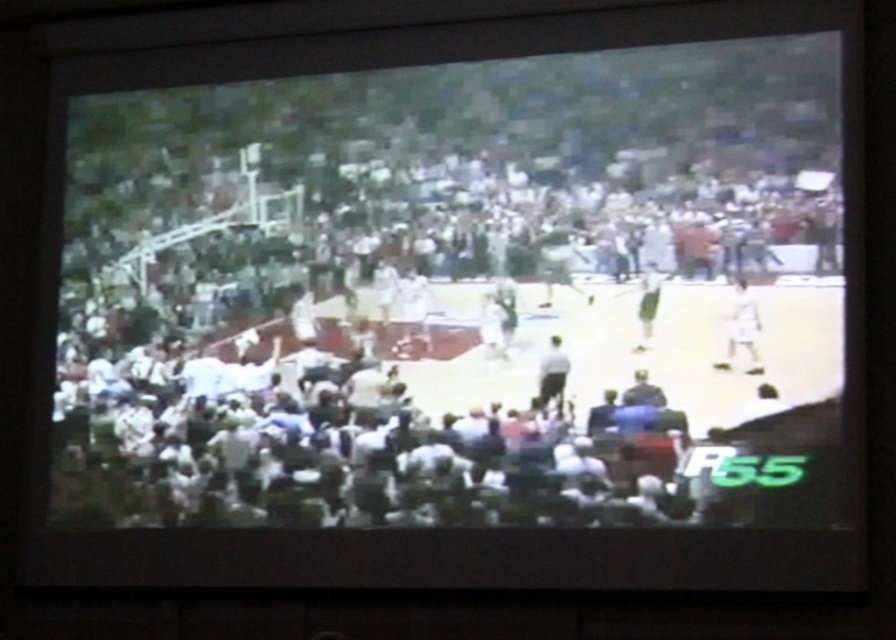
You are a photographer trying to capture a clear shot of the white matte basketball player at right and the white fabric person at center in the blurry sports event image. Considering their sizes in the image, which subject would you focus on to ensure the details are more visible?

The white matte basketball player at right has a larger size compared to the white fabric person at center, so focusing on the white matte basketball player at right would provide more visible details due to its larger size in the image.

You are a photographer trying to capture a clear shot of the white matte basketball player at right and the light gray fabric person at center during the game. Considering their sizes, which one might be closer to the camera?

The white matte basketball player at right is larger in size compared to the light gray fabric person at center, which suggests that the white matte basketball player at right is closer to the camera.

You are a photographer trying to capture a clear shot of the white jersey basketball team at center and the light gray fabric person at center during the game. Based on their positions, which team member is closer to the left side of the screen?

A: The white jersey basketball team at center is positioned on the left side of the light gray fabric person at center, meaning the white jersey basketball team at center is closer to the left side of the screen.